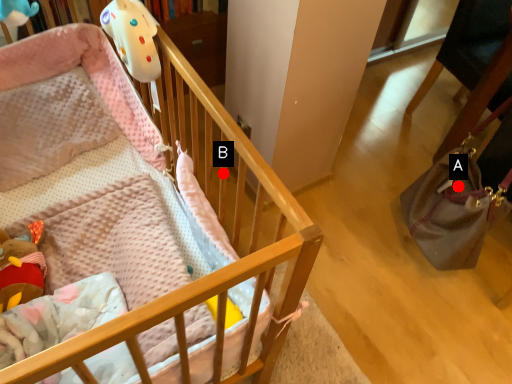
Question: Two points are circled on the image, labeled by A and B beside each circle. Which point is farther to the camera?

Choices:
 (A) A is further
 (B) B is further

Answer: (A)